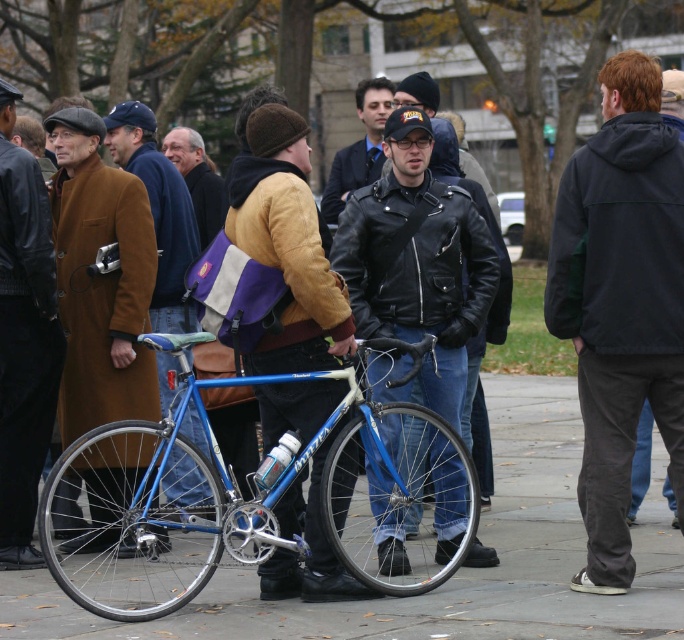
Is blue metallic bicycle at center shorter than black leather jacket at center?

Yes, blue metallic bicycle at center is shorter than black leather jacket at center.

Which of these two, blue metallic bicycle at center or black leather jacket at center, stands taller?

black leather jacket at center is taller.

I want to click on blue metallic bicycle at center, so click(256, 508).

Is blue metallic bicycle at center thinner than brown wool coat at left?

No.

Consider the image. How far apart are blue metallic bicycle at center and brown wool coat at left?

A distance of 5.85 feet exists between blue metallic bicycle at center and brown wool coat at left.

Which is in front, point (140, 490) or point (140, 298)?

Point (140, 490) is in front.

In order to click on blue metallic bicycle at center in this screenshot , I will do `click(256, 508)`.

Locate an element on the screen. The width and height of the screenshot is (684, 640). dark gray hoodie at right is located at coordinates (620, 301).

Is dark gray hoodie at right to the right of dark gray hooded jacket at right from the viewer's perspective?

Incorrect, dark gray hoodie at right is not on the right side of dark gray hooded jacket at right.

Is point (620, 531) less distant than point (683, 141)?

Yes, it is in front of point (683, 141).

Find the location of a particular element. The image size is (684, 640). dark gray hoodie at right is located at coordinates (620, 301).